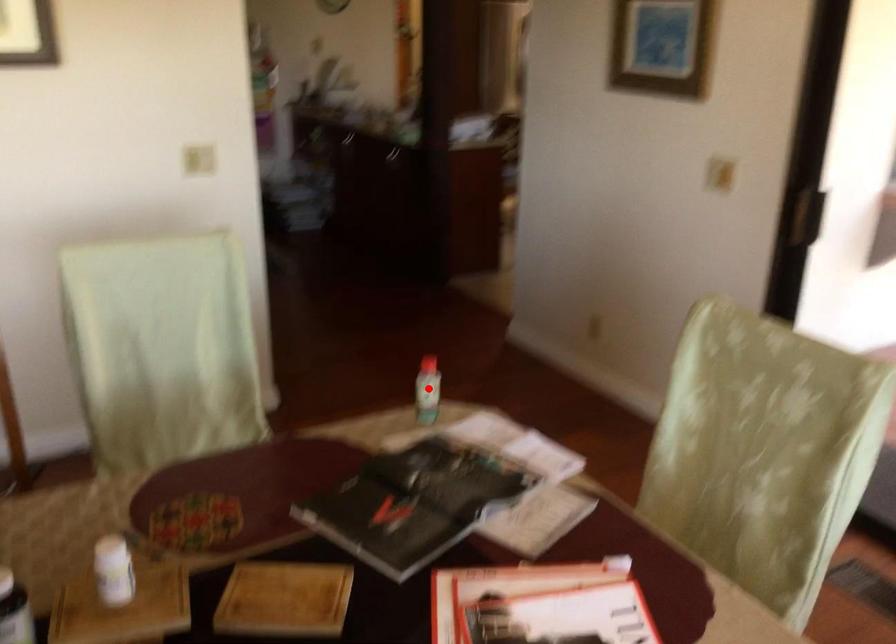
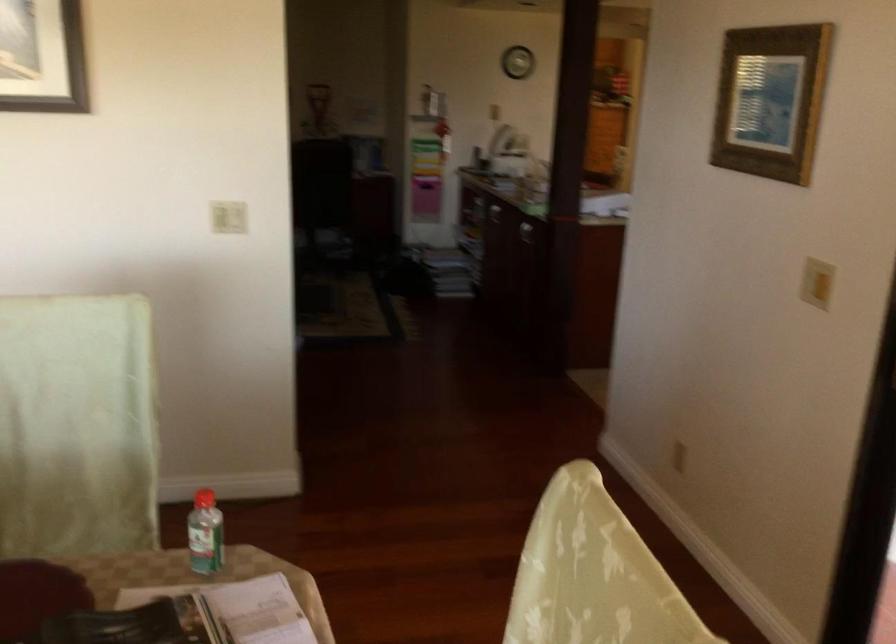
Question: I am providing you with two images of the same scene from different viewpoints. In image1, a red point is highlighted. Considering the same 3D point in image2, which of the following is correct?

Choices:
 (A) It is closer
 (B) It is farther

Answer: (A)